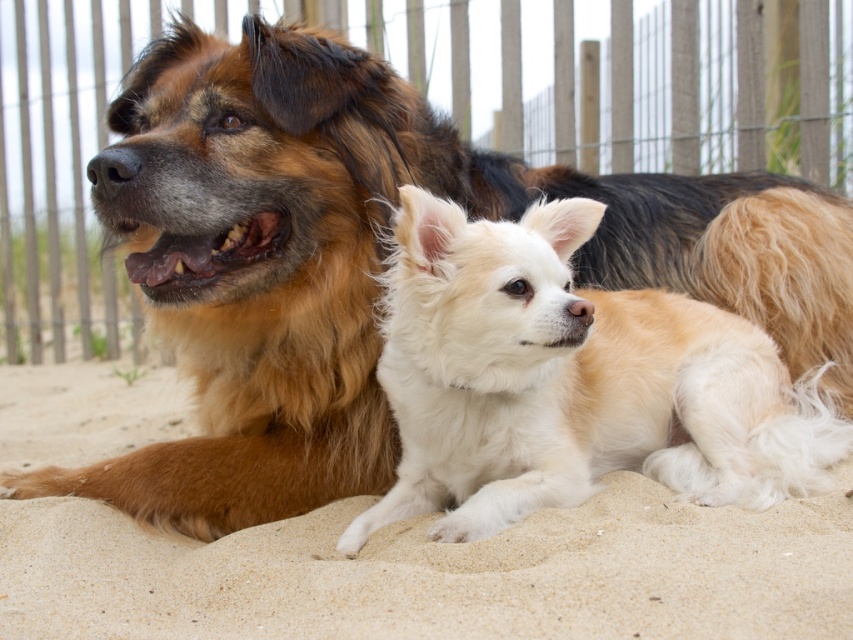
You are a photographer trying to capture a photo of the fluffy white dog at center. The wooden fence at upper center might block the shot. Based on their positions, will the fence interfere with your ability to take a clear photo of the dog?

The fluffy white dog at center is positioned under the wooden fence at upper center, so the fence may block part of the dog in the photo.